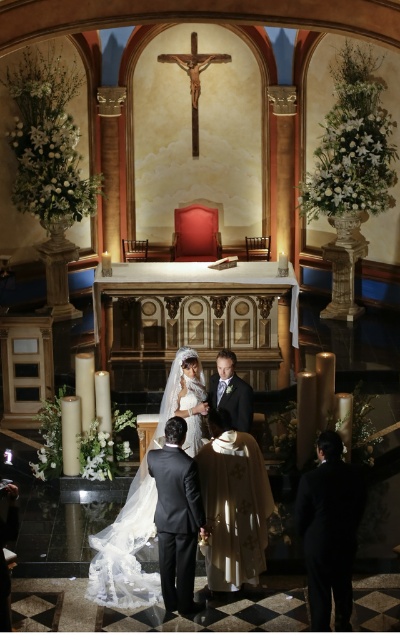
Based on the photo, is white lace veil at center bigger than satin white dress at center?

Correct, white lace veil at center is larger in size than satin white dress at center.

Identify the location of white lace veil at center. (126, 550).

Based on the photo, can you confirm if black suit at lower right is positioned to the left of shiny black suit at center?

No, black suit at lower right is not to the left of shiny black suit at center.

Who is more distant from viewer, [336,579] or [233,413]?

The point [233,413] is more distant.

Find the location of a particular element. black suit at lower right is located at coordinates (330, 531).

The image size is (400, 640). Identify the location of white lace veil at center. (126, 550).

Does white lace veil at center have a smaller size compared to shiny black suit at center?

Incorrect, white lace veil at center is not smaller in size than shiny black suit at center.

The image size is (400, 640). What do you see at coordinates (126, 550) in the screenshot?
I see `white lace veil at center` at bounding box center [126, 550].

Image resolution: width=400 pixels, height=640 pixels. In order to click on white lace veil at center in this screenshot , I will do `click(126, 550)`.